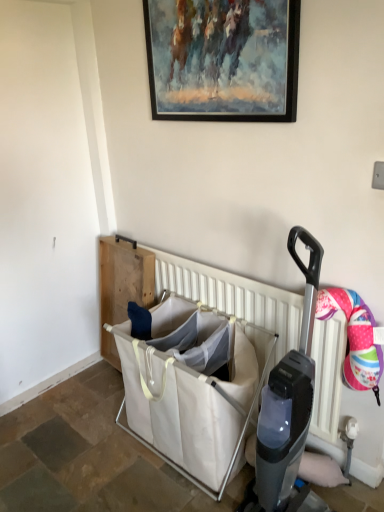
Question: Based on their positions, is white canvas laundry basket at center located to the left or right of white plastic radiator at center?

Choices:
 (A) right
 (B) left

Answer: (B)

Question: Considering their positions, is white canvas laundry basket at center located in front of or behind white plastic radiator at center?

Choices:
 (A) front
 (B) behind

Answer: (A)

Question: Which object is the farthest from the white canvas laundry basket at center?

Choices:
 (A) white plastic radiator at center
 (B) painted wood picture frame at upper center

Answer: (B)

Question: Estimate the real-world distances between objects in this image. Which object is farther from the white plastic radiator at center?

Choices:
 (A) painted wood picture frame at upper center
 (B) white canvas laundry basket at center

Answer: (A)